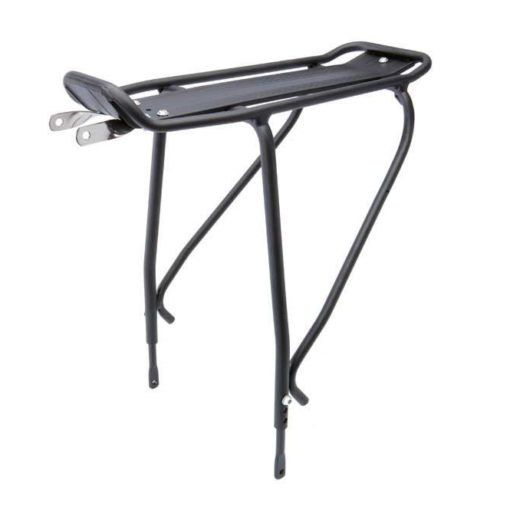
This screenshot has height=510, width=510. What are the coordinates of `black seat` in the screenshot? It's located at (262, 88).